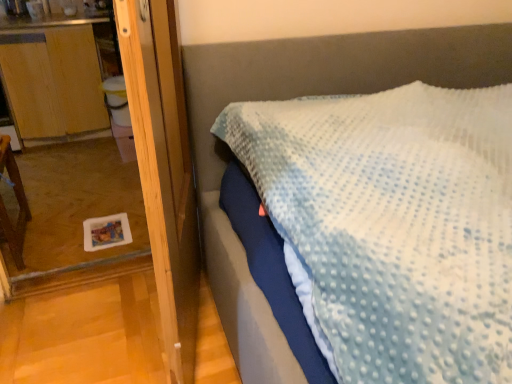
The width and height of the screenshot is (512, 384). What are the coordinates of `vacant space to the right of brown wooden chair at left` in the screenshot? It's located at (81, 237).